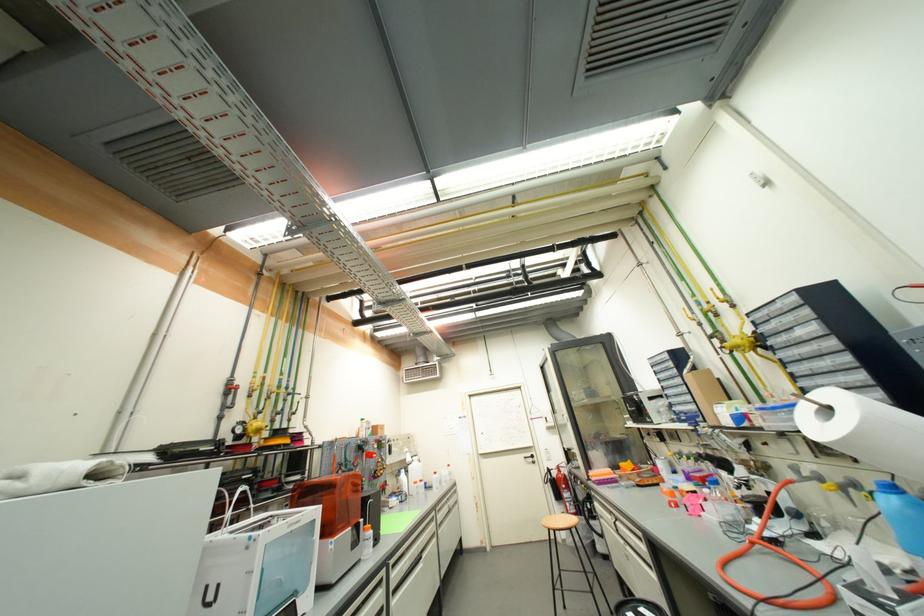
Find where to turn the black door handle. Please return your answer as a coordinate pair (x, y).

(529, 458)